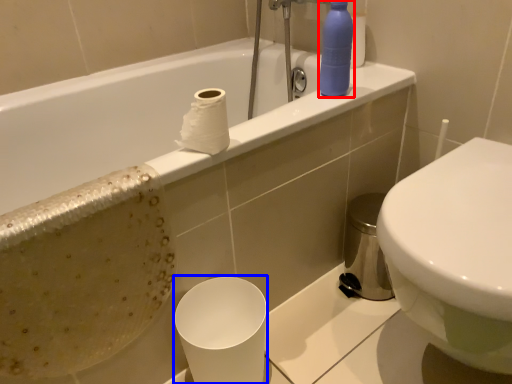
Question: Which of the following is the closest to the observer, cleaning product (highlighted by a red box) or paper cup (highlighted by a blue box)?

Choices:
 (A) cleaning product
 (B) paper cup

Answer: (B)